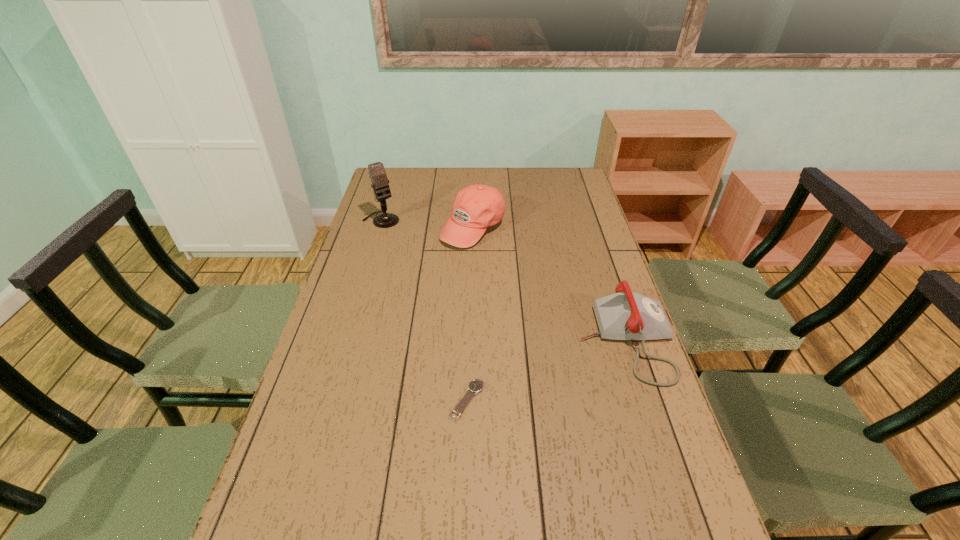
Locate an element on the screen. free space on the desktop that is between the watch and the rightmost object and is positioned on the front-facing side of the baseball cap is located at coordinates (573, 360).

You are a GUI agent. You are given a task and a screenshot of the screen. Output one action in this format:
    pyautogui.click(x=<x>, y=<y>)
    Task: Click on the vacant space on the desktop that is between the watch and the second shortest object and is positioned on the front-facing side of the tallest object
    The height and width of the screenshot is (540, 960).
    Given the screenshot: What is the action you would take?
    [528, 377]